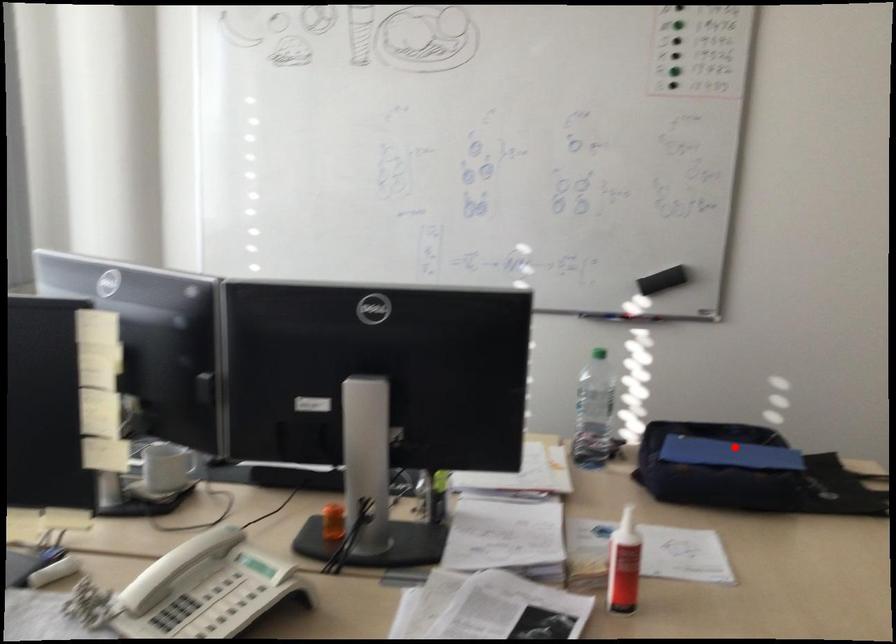
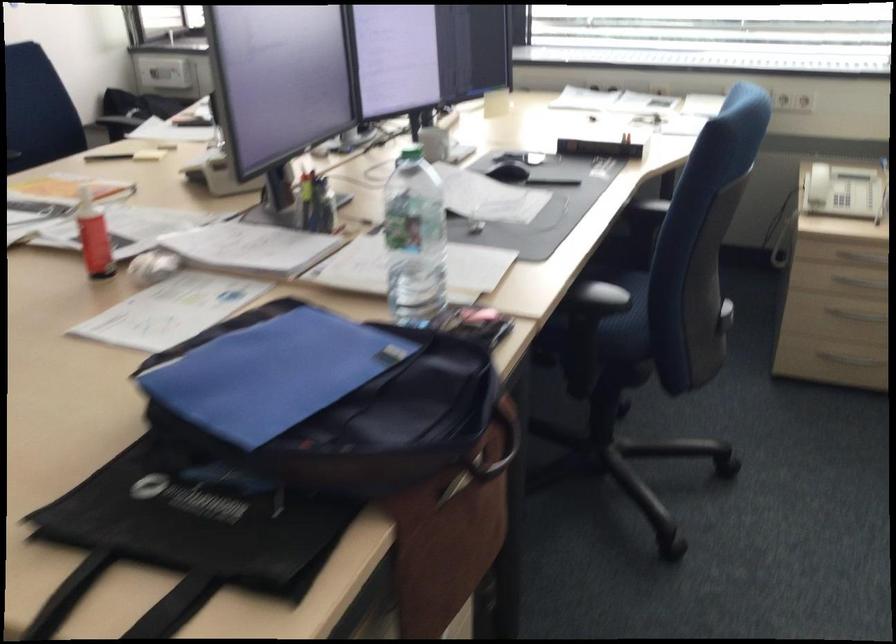
Question: I am providing you with two images of the same scene from different viewpoints. Given a red point in image1, look at the same physical point in image2. Is it:

Choices:
 (A) Closer to the viewpoint
 (B) Farther from the viewpoint

Answer: (A)